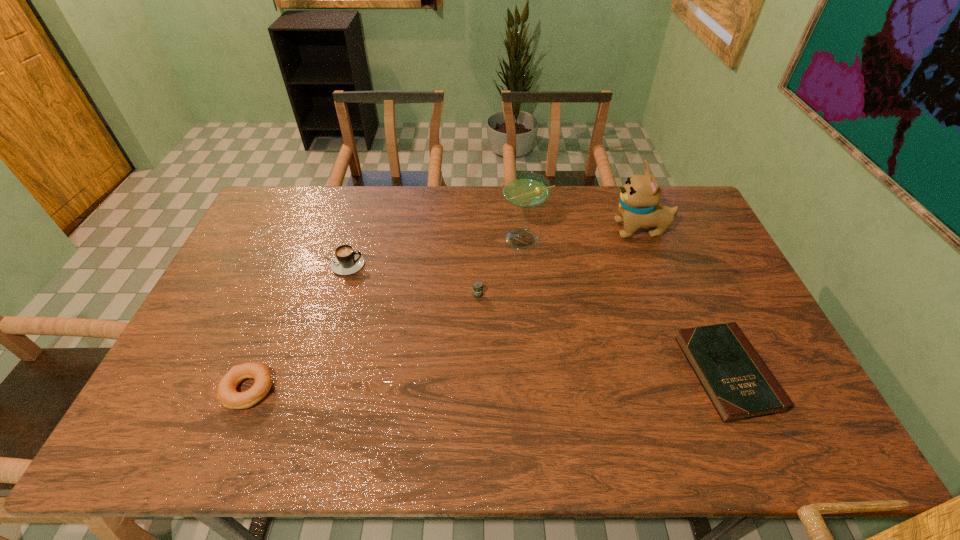
At what (x,y) coordinates should I click in order to perform the action: click on Bible at the right edge. Please return your answer as a coordinate pair (x, y). This screenshot has width=960, height=540. Looking at the image, I should click on (740, 386).

You are a GUI agent. You are given a task and a screenshot of the screen. Output one action in this format:
    pyautogui.click(x=<x>, y=<y>)
    Task: Click on the object that is at the far right corner
    The height and width of the screenshot is (540, 960).
    Given the screenshot: What is the action you would take?
    pyautogui.click(x=639, y=206)

Find the location of a particular element. The image size is (960, 540). object present at the near right corner is located at coordinates (740, 386).

You are a GUI agent. You are given a task and a screenshot of the screen. Output one action in this format:
    pyautogui.click(x=<x>, y=<y>)
    Task: Click on the vacant space at the far edge
    The width and height of the screenshot is (960, 540).
    Given the screenshot: What is the action you would take?
    pyautogui.click(x=444, y=217)

The height and width of the screenshot is (540, 960). What are the coordinates of `vacant space at the near edge of the desktop` in the screenshot? It's located at (618, 430).

This screenshot has width=960, height=540. I want to click on vacant space at the left edge of the desktop, so click(223, 278).

Locate an element on the screen. vacant area at the right edge of the desktop is located at coordinates (668, 235).

Where is `free region at the far right corner of the desktop`? free region at the far right corner of the desktop is located at coordinates [690, 204].

Identify the location of free point between the bagel and the Bible. (488, 381).

You are a GUI agent. You are given a task and a screenshot of the screen. Output one action in this format:
    pyautogui.click(x=<x>, y=<y>)
    Task: Click on the free space between the third nearest object and the third tallest object
    The height and width of the screenshot is (540, 960).
    Given the screenshot: What is the action you would take?
    pyautogui.click(x=410, y=280)